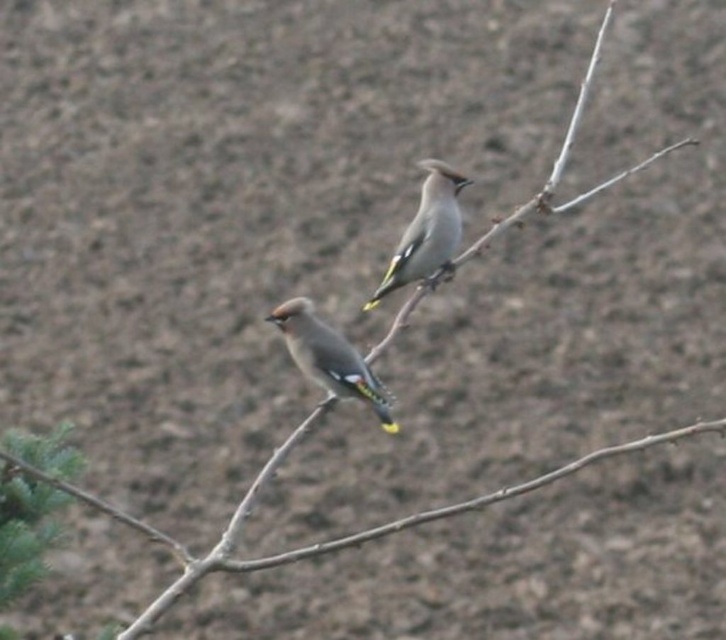
You are a birdwatcher observing the two birds in the scene. Which bird is shorter in height between the shiny brown bird at center and the speckled gray bird at center?

The shiny brown bird at center is not as tall as the speckled gray bird at center, so the shiny brown bird at center is shorter in height.

You are a birdwatcher observing the two birds in the image. Which bird is positioned closer to you, the shiny brown bird at center or the speckled gray bird at center?

The shiny brown bird at center is closer to the viewer than the speckled gray bird at center.